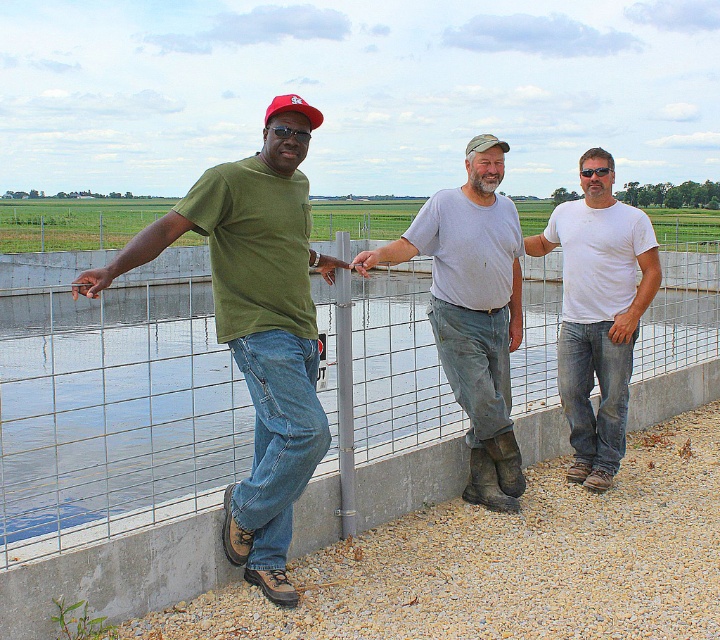
Question: Is gray matte shirt at center to the right of red matte baseball cap at upper left from the viewer's perspective?

Choices:
 (A) yes
 (B) no

Answer: (A)

Question: Which point is farther to the camera?

Choices:
 (A) (302, 336)
 (B) (288, 100)

Answer: (A)

Question: Which is nearer to the white matte t-shirt at center?

Choices:
 (A) gray matte shirt at center
 (B) green matte t-shirt at center
 (C) clear water at center

Answer: (A)

Question: Which point is farther to the camera?

Choices:
 (A) (366, 269)
 (B) (570, 296)

Answer: (B)

Question: Is clear water at center above gray matte shirt at center?

Choices:
 (A) no
 (B) yes

Answer: (B)

Question: Does clear water at center lie in front of white matte t-shirt at center?

Choices:
 (A) no
 (B) yes

Answer: (B)